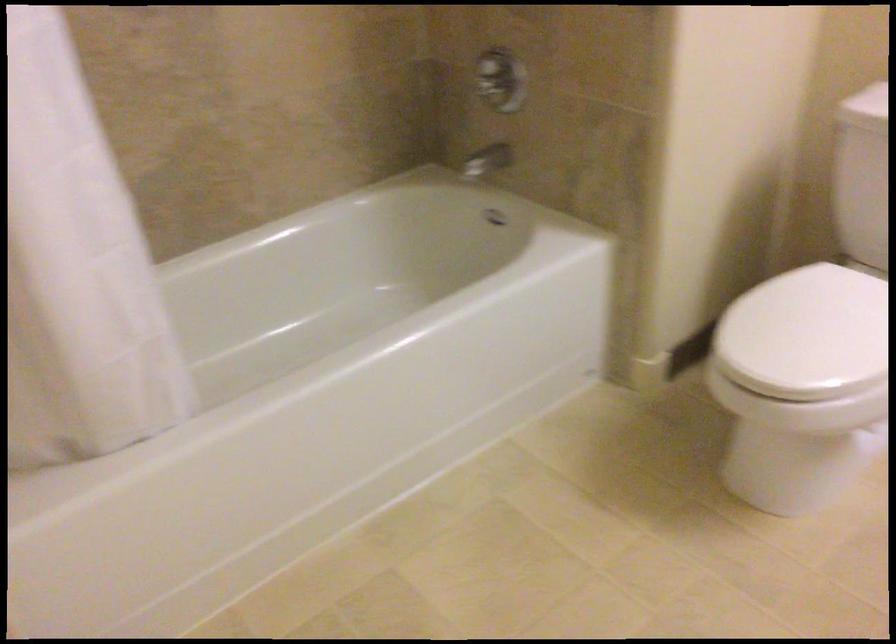
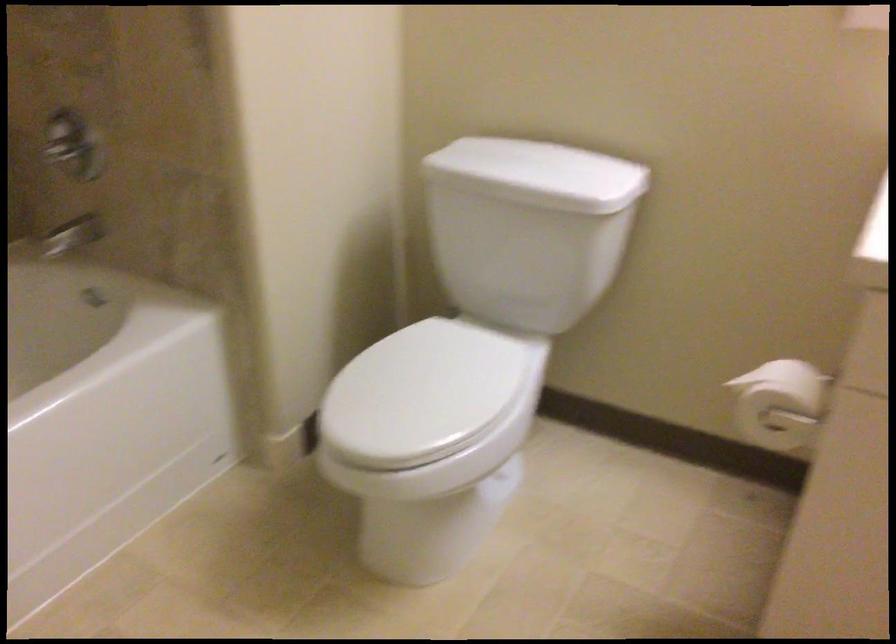
Question: How did the camera likely rotate?

Choices:
 (A) Left
 (B) Right
 (C) Up
 (D) Down

Answer: (B)